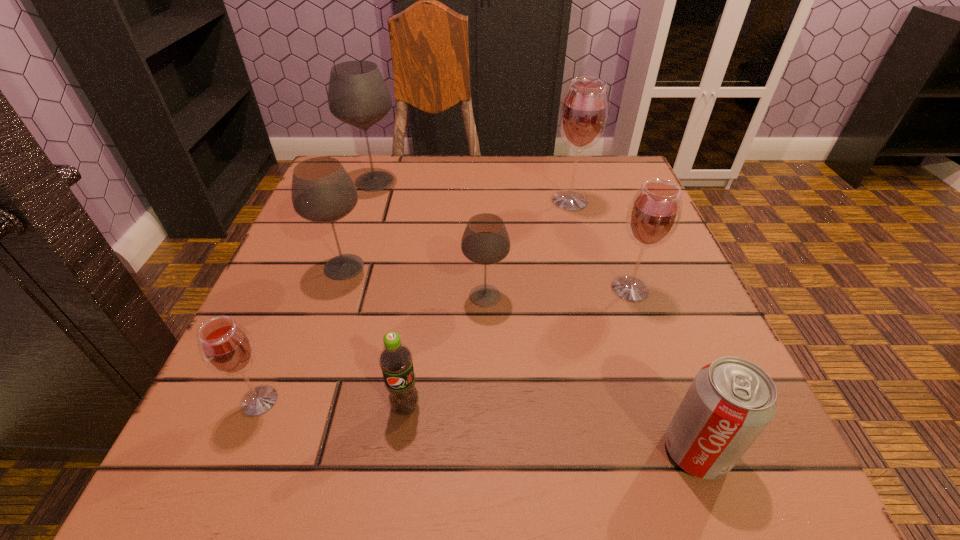
At what (x,y) coordinates should I click in order to perform the action: click on object at the near edge. Please return your answer as a coordinate pair (x, y). Image resolution: width=960 pixels, height=540 pixels. Looking at the image, I should click on (730, 402).

Locate an element on the screen. Image resolution: width=960 pixels, height=540 pixels. soda can that is at the right edge is located at coordinates (730, 402).

The height and width of the screenshot is (540, 960). I want to click on object positioned at the far left corner, so click(x=358, y=95).

Locate an element on the screen. object at the far right corner is located at coordinates (584, 111).

This screenshot has width=960, height=540. I want to click on object that is at the near right corner, so click(x=730, y=402).

What are the coordinates of `vacant region at the far edge of the desktop` in the screenshot? It's located at (513, 199).

You are a GUI agent. You are given a task and a screenshot of the screen. Output one action in this format:
    pyautogui.click(x=<x>, y=<y>)
    Task: Click on the free space at the near edge of the desktop
    The height and width of the screenshot is (540, 960).
    Given the screenshot: What is the action you would take?
    pyautogui.click(x=628, y=457)

Where is `vacant space at the left edge`? The image size is (960, 540). vacant space at the left edge is located at coordinates (279, 331).

Find the location of a particular element. vacant region at the right edge of the desktop is located at coordinates (694, 291).

Locate an element on the screen. This screenshot has height=540, width=960. vacant point at the far left corner is located at coordinates (365, 164).